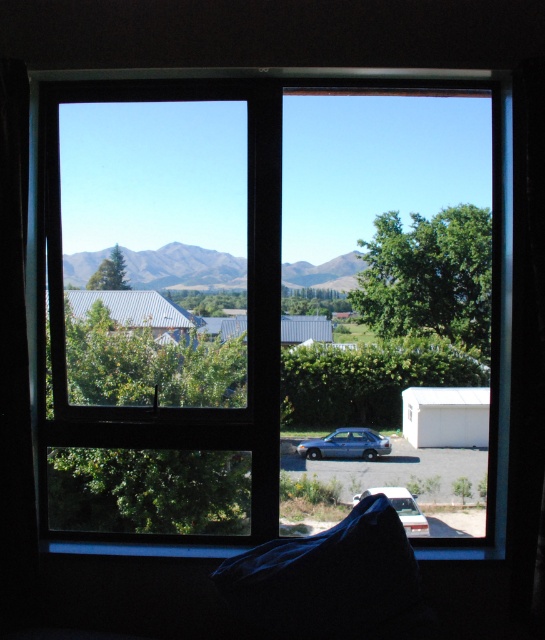
Question: Considering the relative positions of transparent glass window at center and metallic blue sedan at center in the image provided, where is transparent glass window at center located with respect to metallic blue sedan at center?

Choices:
 (A) right
 (B) left

Answer: (A)

Question: Considering the relative positions of metallic blue sedan at center and matte silver sedan at lower right in the image provided, where is metallic blue sedan at center located with respect to matte silver sedan at lower right?

Choices:
 (A) below
 (B) above

Answer: (B)

Question: Can you confirm if green grassy mountain at center is thinner than matte silver sedan at lower right?

Choices:
 (A) yes
 (B) no

Answer: (B)

Question: Which of these objects is positioned farthest from the metallic blue sedan at center?

Choices:
 (A) transparent glass window at center
 (B) green grassy mountain at center
 (C) matte silver sedan at lower right

Answer: (B)

Question: Estimate the real-world distances between objects in this image. Which object is closer to the metallic blue sedan at center?

Choices:
 (A) matte silver sedan at lower right
 (B) transparent glass window at center
 (C) green grassy mountain at center

Answer: (B)

Question: Which of these objects is positioned closest to the transparent glass window at center?

Choices:
 (A) metallic blue sedan at center
 (B) green grassy mountain at center
 (C) matte silver sedan at lower right

Answer: (B)